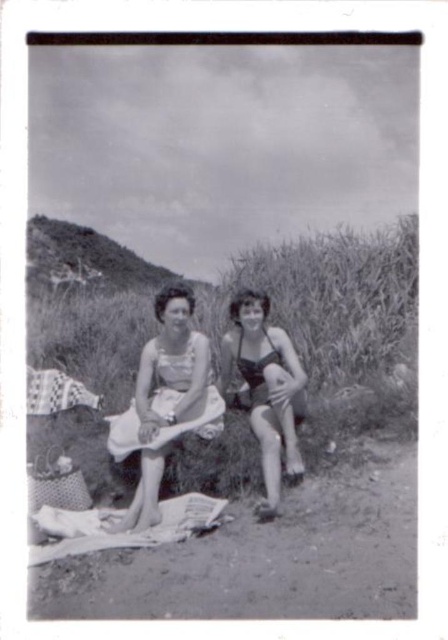
Question: Which of the following is the farthest from the observer?

Choices:
 (A) (302, 404)
 (B) (197, 412)
 (C) (68, 282)
 (D) (203, 344)

Answer: (C)

Question: Is matte white dress at center positioned in front of white cloth at center?

Choices:
 (A) yes
 (B) no

Answer: (A)

Question: Which point appears farthest from the camera in this image?

Choices:
 (A) (146, 268)
 (B) (219, 428)
 (C) (120, 444)

Answer: (A)

Question: Does matte white dress at center appear over grassy hillside at upper left?

Choices:
 (A) yes
 (B) no

Answer: (B)

Question: Can you confirm if matte white dress at center is thinner than grassy hillside at upper left?

Choices:
 (A) yes
 (B) no

Answer: (B)

Question: Estimate the real-world distances between objects in this image. Which object is closer to the matte white dress at center?

Choices:
 (A) grassy hillside at upper left
 (B) matte black swimsuit at center
 (C) white cloth at center

Answer: (C)